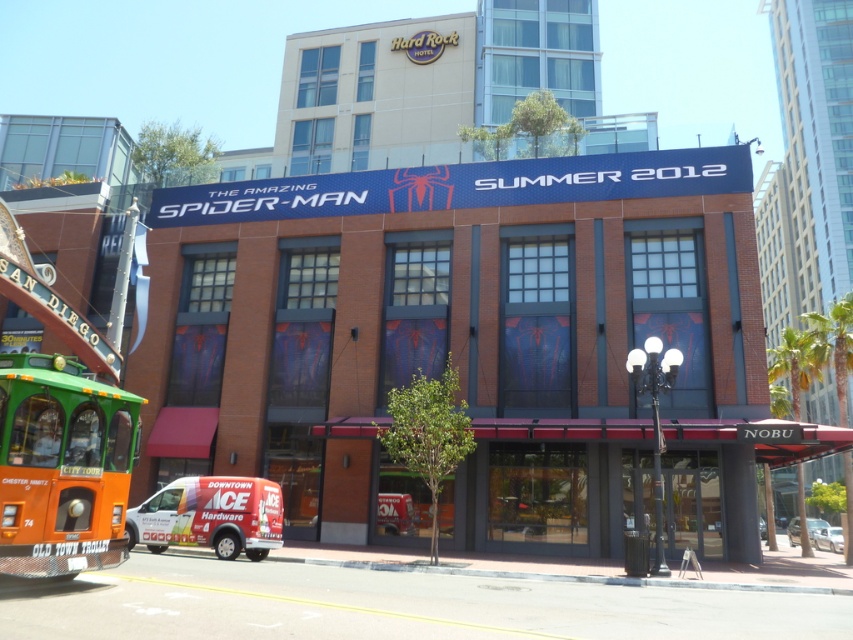
Question: Does orange matte trolley at lower left have a larger size compared to white vinyl van at lower left?

Choices:
 (A) no
 (B) yes

Answer: (A)

Question: Can you confirm if orange matte trolley at lower left is thinner than white vinyl van at lower left?

Choices:
 (A) no
 (B) yes

Answer: (B)

Question: Can you confirm if orange matte trolley at lower left is positioned to the right of white vinyl van at lower left?

Choices:
 (A) no
 (B) yes

Answer: (B)

Question: Which point is closer to the camera?

Choices:
 (A) (138, 429)
 (B) (173, 508)

Answer: (A)

Question: Which point is farther to the camera?

Choices:
 (A) orange matte trolley at lower left
 (B) white vinyl van at lower left

Answer: (B)